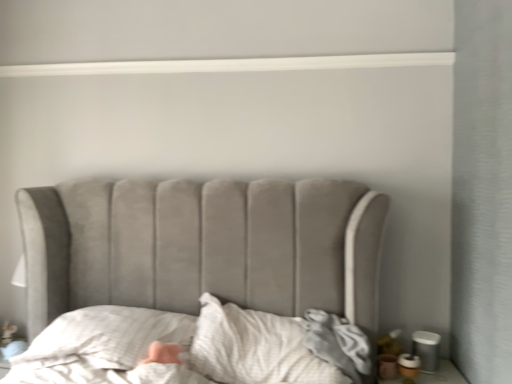
Question: Looking at their shapes, would you say white textured sheet at center is wider or thinner than white textured pillow at lower left?

Choices:
 (A) thin
 (B) wide

Answer: (A)

Question: Which is correct: white textured sheet at center is inside white textured pillow at lower left, or outside of it?

Choices:
 (A) inside
 (B) outside

Answer: (B)

Question: Is white textured sheet at center bigger or smaller than white textured pillow at lower left?

Choices:
 (A) small
 (B) big

Answer: (B)

Question: In the image, is white textured pillow at lower left positioned in front of or behind white textured sheet at center?

Choices:
 (A) front
 (B) behind

Answer: (B)

Question: Considering the positions of white textured pillow at lower left and white textured sheet at center in the image, is white textured pillow at lower left taller or shorter than white textured sheet at center?

Choices:
 (A) tall
 (B) short

Answer: (B)

Question: Considering the relative positions of white textured pillow at lower left and white textured sheet at center in the image provided, is white textured pillow at lower left to the left or to the right of white textured sheet at center?

Choices:
 (A) left
 (B) right

Answer: (A)

Question: Is point (x=13, y=365) positioned closer to the camera than point (x=317, y=375)?

Choices:
 (A) farther
 (B) closer

Answer: (A)